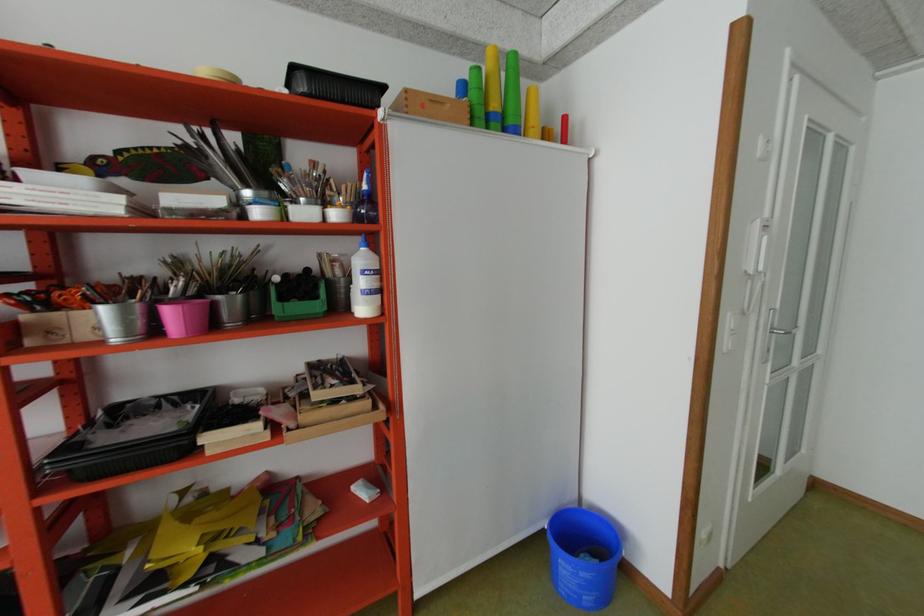
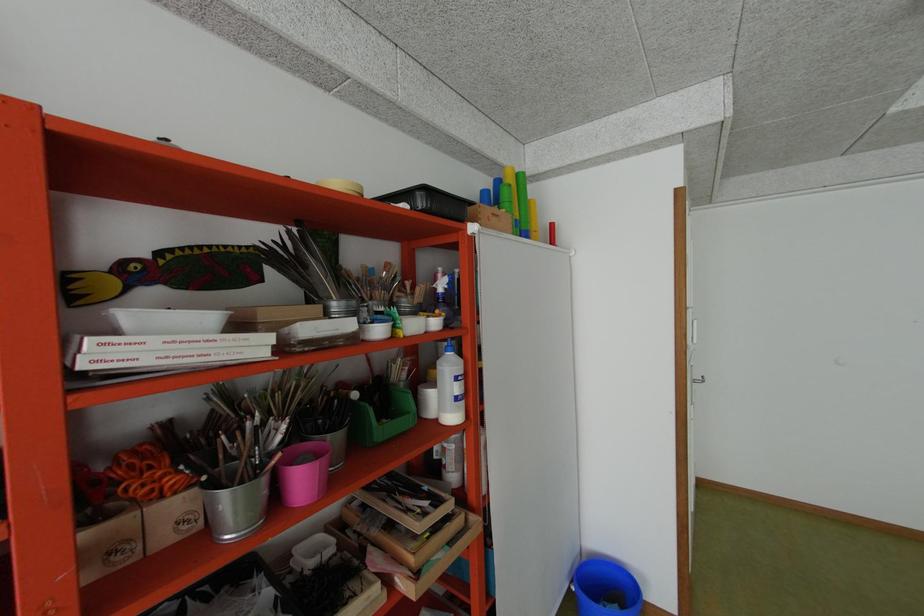
Question: In a continuous first-person perspective shot, in which direction is the camera moving?

Choices:
 (A) Left
 (B) Right
 (C) Forward
 (D) Backward

Answer: (A)